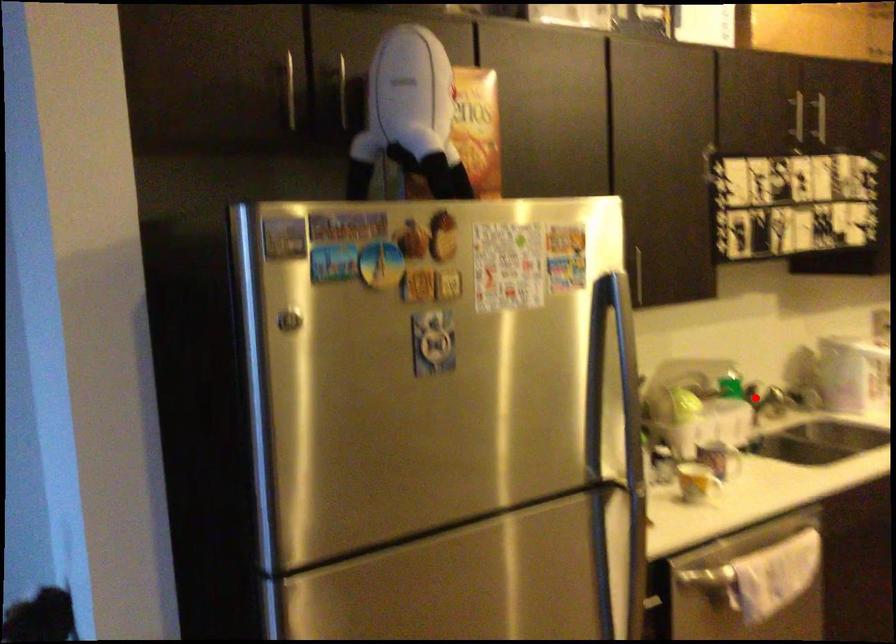
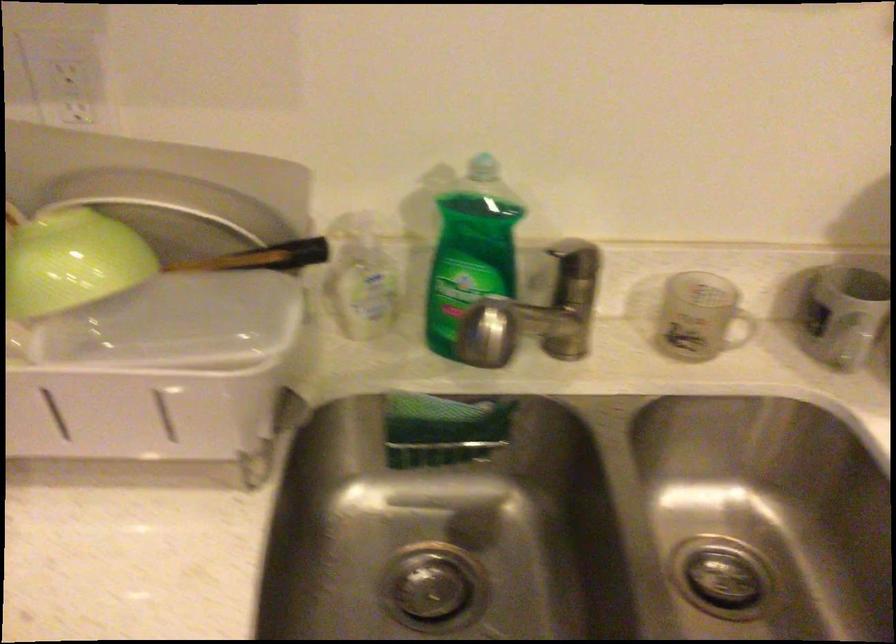
The point at the highlighted location is marked in the first image. Where is the corresponding point in the second image?

(572, 306)